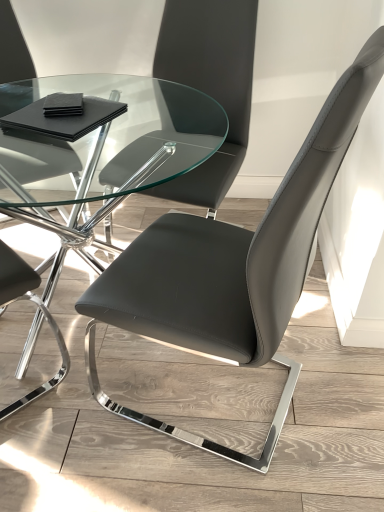
Question: Looking at the image, does matte black chair at center, the first chair positioned from the top, seem bigger or smaller compared to matte black chair at center, placed as the 2th chair when sorted from top to bottom?

Choices:
 (A) big
 (B) small

Answer: (B)

Question: Does point (198, 38) appear closer or farther from the camera than point (152, 271)?

Choices:
 (A) farther
 (B) closer

Answer: (A)

Question: Considering the real-world distances, which object is farthest from the matte black chair at center, the first chair positioned from the top?

Choices:
 (A) matte black chair at center, placed as the 2th chair when sorted from top to bottom
 (B) transparent glass table at center

Answer: (A)

Question: Which is nearer to the matte black chair at center, which is counted as the first chair, starting from the bottom?

Choices:
 (A) transparent glass table at center
 (B) matte black chair at center, the first chair positioned from the top

Answer: (B)